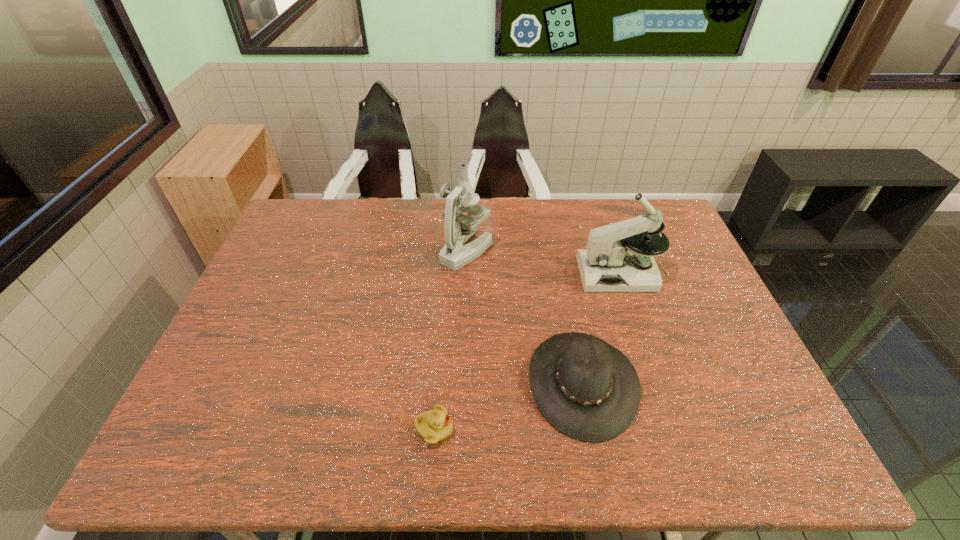
I want to click on free region located 0.120m on the front-facing side of the hat, so coord(480,383).

Find the location of a particular element. This screenshot has width=960, height=540. free spot located on the front-facing side of the duckling is located at coordinates (626, 429).

The width and height of the screenshot is (960, 540). In order to click on object that is at the far edge in this screenshot , I will do point(458,228).

Image resolution: width=960 pixels, height=540 pixels. I want to click on hat located in the near edge section of the desktop, so click(x=587, y=389).

In order to click on duckling that is at the near edge in this screenshot , I will do `click(435, 425)`.

Where is `object that is at the right edge`? The width and height of the screenshot is (960, 540). object that is at the right edge is located at coordinates (607, 265).

This screenshot has height=540, width=960. Find the location of `free location at the far edge of the desktop`. free location at the far edge of the desktop is located at coordinates (390, 230).

The image size is (960, 540). Identify the location of free space at the near edge of the desktop. (293, 458).

The width and height of the screenshot is (960, 540). Find the location of `vacant area at the left edge of the desktop`. vacant area at the left edge of the desktop is located at coordinates (268, 368).

The image size is (960, 540). In the image, there is a desktop. Find the location of `vacant space at the right edge`. vacant space at the right edge is located at coordinates (696, 313).